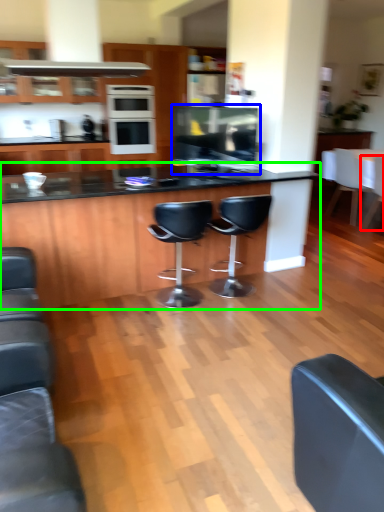
Question: Which object is the farthest from chair (highlighted by a red box)? Choose among these: appliance (highlighted by a blue box) or table (highlighted by a green box).

Choices:
 (A) appliance
 (B) table

Answer: (B)